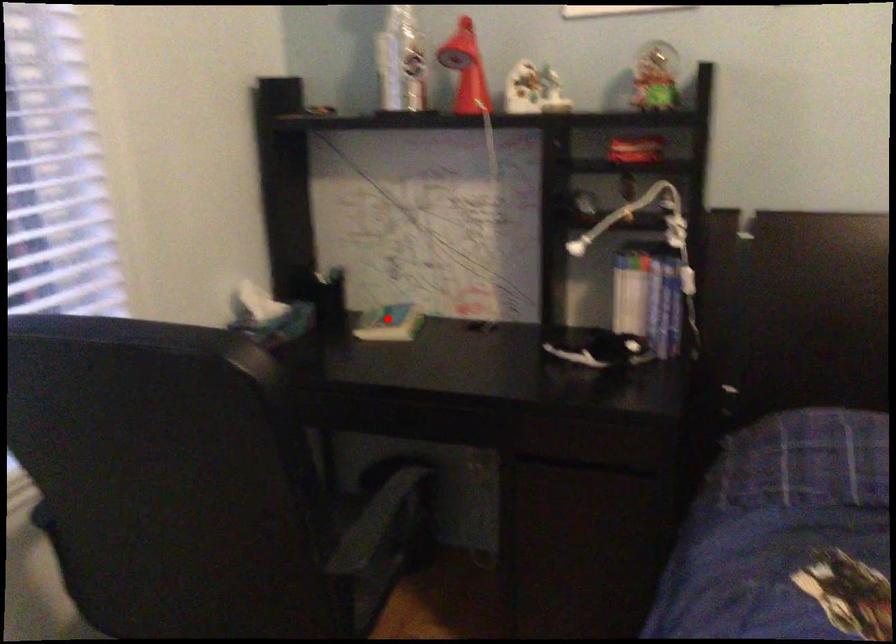
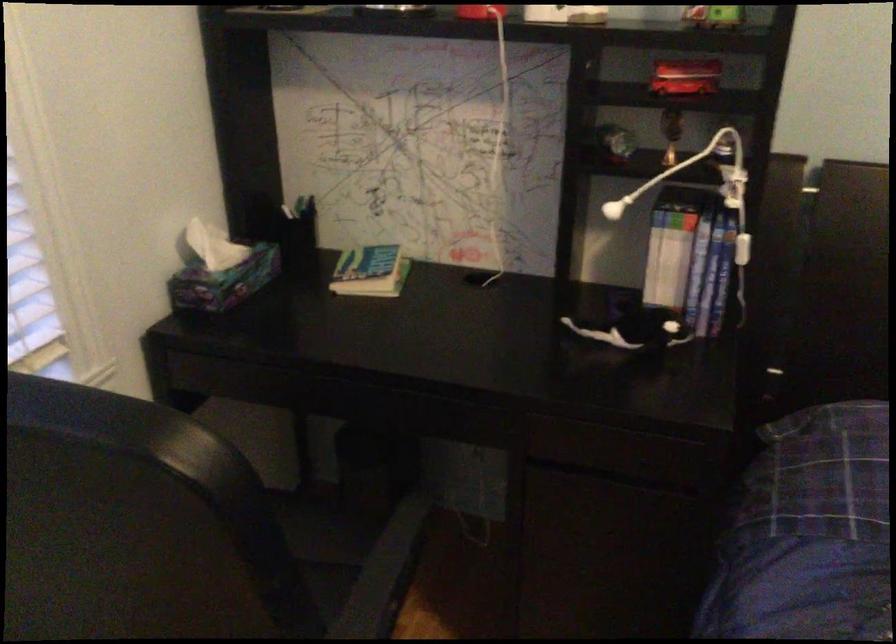
Question: I am providing you with two images of the same scene from different viewpoints. A red point is marked on the first image. Can you still see the location of the red point in image 2?

Choices:
 (A) Yes
 (B) No

Answer: (A)